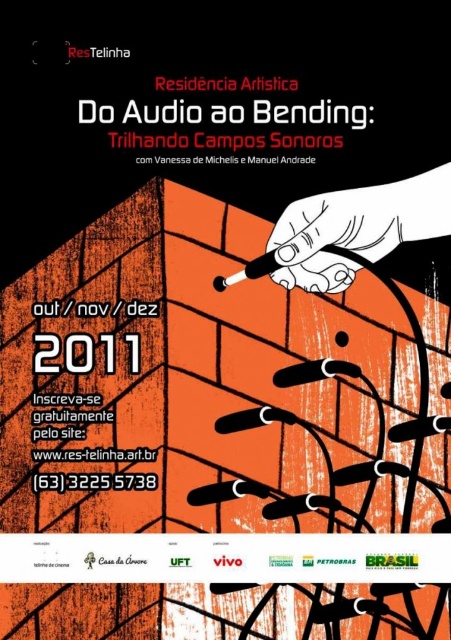
Question: Which of the following is the closest to the observer?

Choices:
 (A) (389, 227)
 (B) (225, 163)

Answer: (A)

Question: Is white matte pencil at center thinner than white paper at center?

Choices:
 (A) yes
 (B) no

Answer: (A)

Question: Which of the following is the closest to the observer?

Choices:
 (A) white paper at center
 (B) white matte pencil at center

Answer: (A)

Question: Where is white matte pencil at center located in relation to white paper at center in the image?

Choices:
 (A) left
 (B) right

Answer: (B)

Question: Is white matte pencil at center below white paper at center?

Choices:
 (A) yes
 (B) no

Answer: (A)